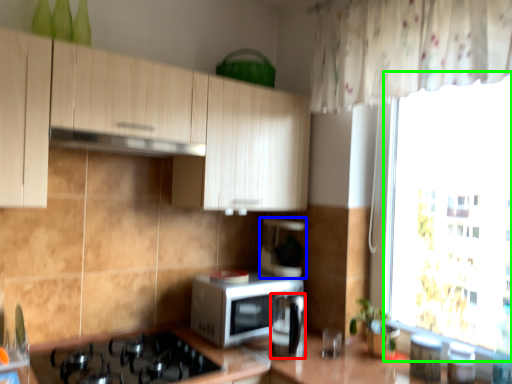
Question: Which object is the farthest from appliance (highlighted by a red box)? Choose among these: coffee machine (highlighted by a blue box) or window screen (highlighted by a green box).

Choices:
 (A) coffee machine
 (B) window screen

Answer: (B)